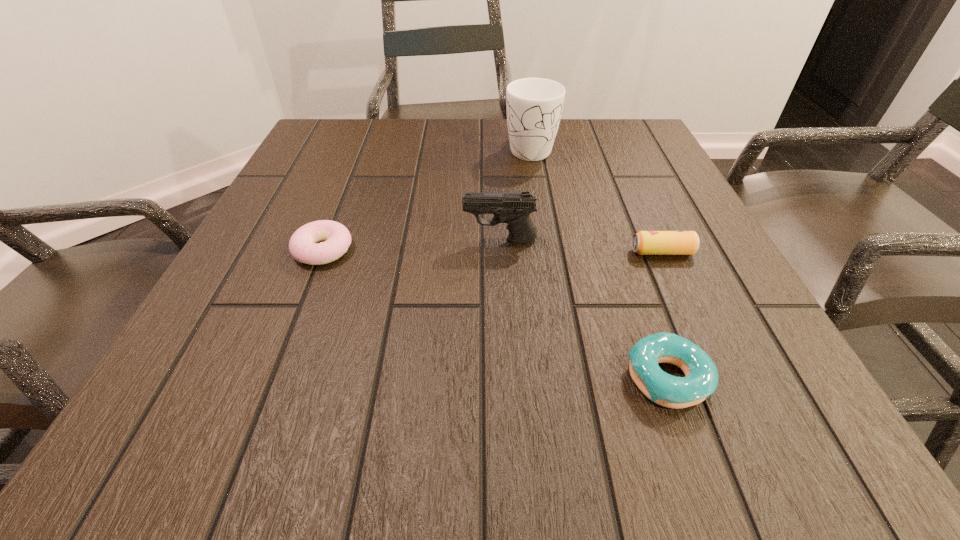
This screenshot has width=960, height=540. I want to click on object at the near right corner, so click(701, 380).

The width and height of the screenshot is (960, 540). I want to click on vacant space at the far edge of the desktop, so click(x=458, y=131).

I want to click on vacant space at the near edge of the desktop, so click(x=546, y=400).

Where is `free space at the left edge of the desktop`? This screenshot has height=540, width=960. free space at the left edge of the desktop is located at coordinates (306, 286).

This screenshot has height=540, width=960. I want to click on vacant space at the right edge of the desktop, so click(x=635, y=178).

You are a GUI agent. You are given a task and a screenshot of the screen. Output one action in this format:
    pyautogui.click(x=<x>, y=<y>)
    Task: Click on the free space at the far left corner of the desktop
    This screenshot has height=540, width=960.
    Given the screenshot: What is the action you would take?
    pyautogui.click(x=306, y=153)

You are a GUI agent. You are given a task and a screenshot of the screen. Output one action in this format:
    pyautogui.click(x=<x>, y=<y>)
    Task: Click on the vacant point at the near left corner
    
    Given the screenshot: What is the action you would take?
    pyautogui.click(x=236, y=423)

Where is `free area in between the right doughnut and the mug`? This screenshot has height=540, width=960. free area in between the right doughnut and the mug is located at coordinates (599, 263).

Locate an element on the screen. vacant area that lies between the right doughnut and the left doughnut is located at coordinates (495, 314).

Locate an element on the screen. Image resolution: width=960 pixels, height=540 pixels. empty space that is in between the beer can and the mug is located at coordinates 596,200.